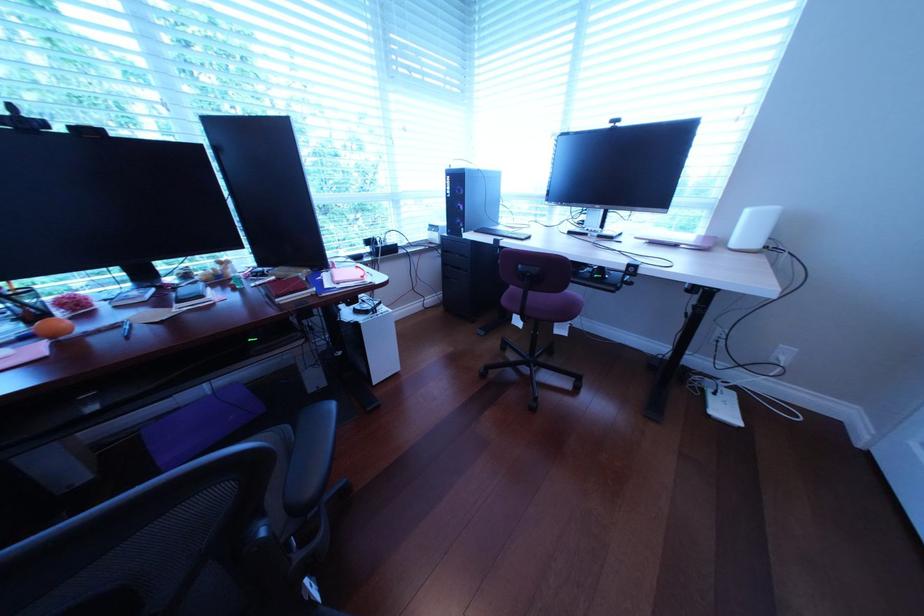
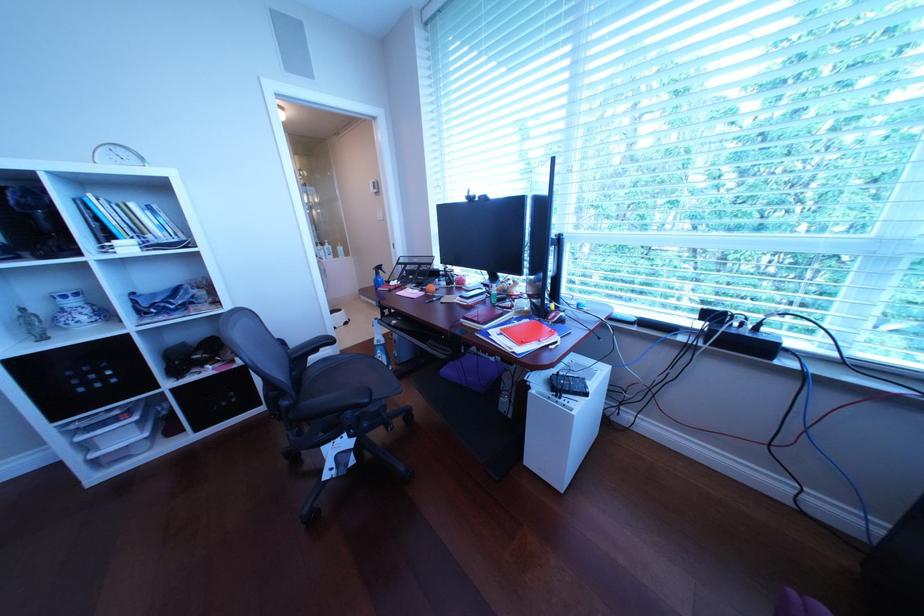
Looking at this image, first-person continuous shooting, in which direction is the camera rotating?

The rotation direction of the camera is left-down.